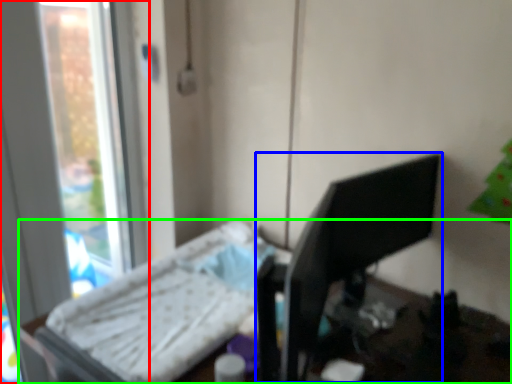
Question: Which object is the farthest from window (highlighted by a red box)? Choose among these: desktop computer (highlighted by a blue box) or furniture (highlighted by a green box).

Choices:
 (A) desktop computer
 (B) furniture

Answer: (A)